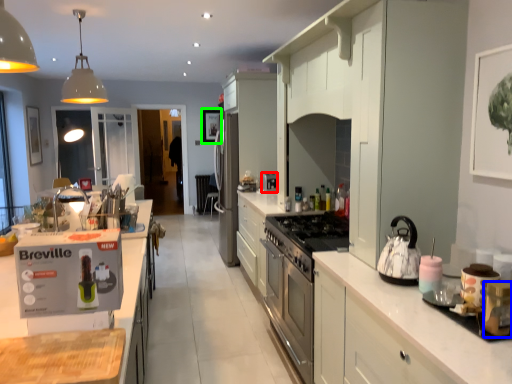
Question: Which object is positioned closest to coffee machine (highlighted by a red box)? Select from appliance (highlighted by a blue box) and picture frame (highlighted by a green box).

Choices:
 (A) appliance
 (B) picture frame

Answer: (A)